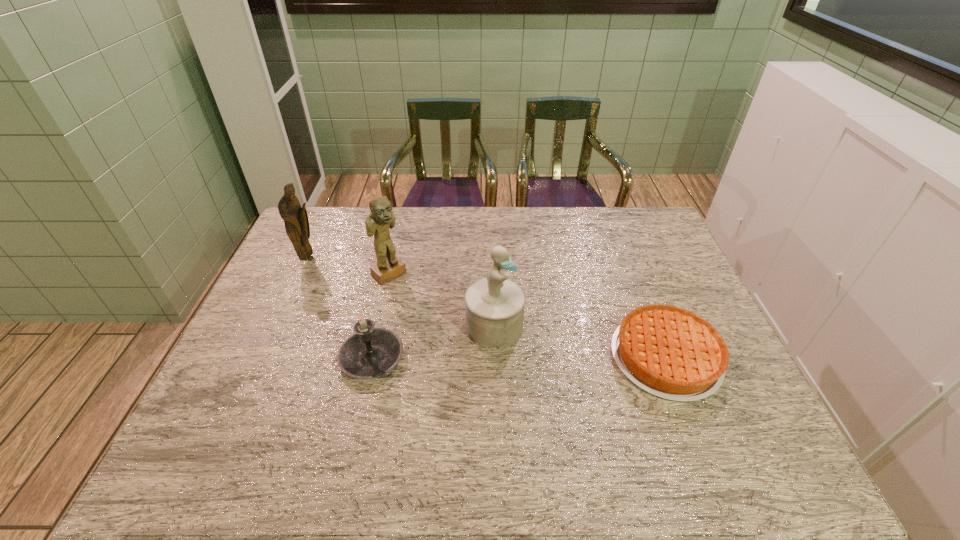
Locate an element on the screen. blank space that satisfies the following two spatial constraints: 1. on the front side of the pie; 2. on the right side of the rightmost figurine is located at coordinates (495, 357).

You are a GUI agent. You are given a task and a screenshot of the screen. Output one action in this format:
    pyautogui.click(x=<x>, y=<y>)
    Task: Click on the vacant space that satisfies the following two spatial constraints: 1. on the front side of the pie; 2. on the right side of the fourth object from left to right
    
    Given the screenshot: What is the action you would take?
    pyautogui.click(x=495, y=357)